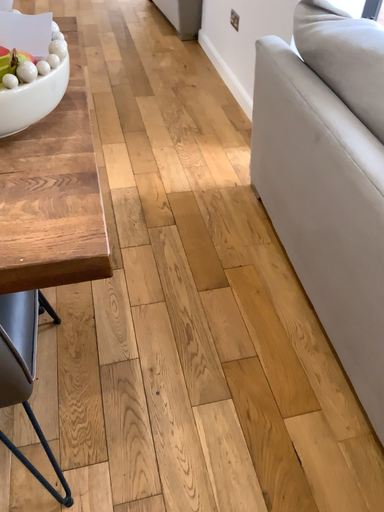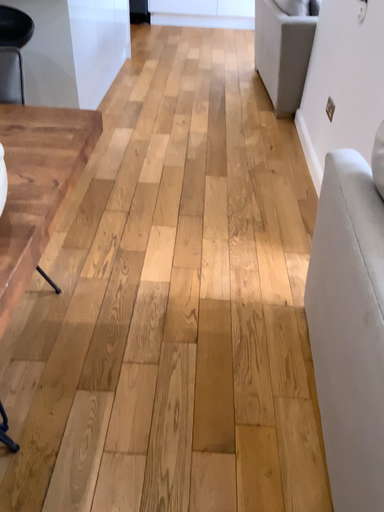
Question: How did the camera likely rotate when shooting the video?

Choices:
 (A) rotated upward
 (B) rotated downward

Answer: (A)